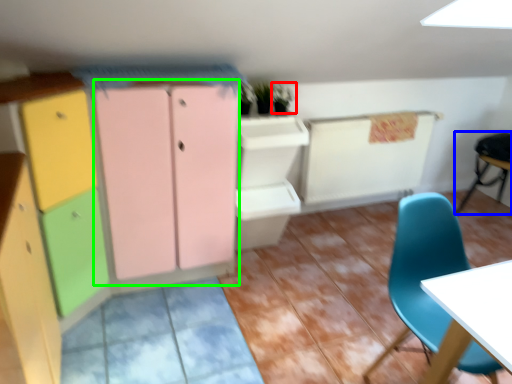
Question: Which is farther away from plant (highlighted by a red box)? chair (highlighted by a blue box) or cabinetry (highlighted by a green box)?

Choices:
 (A) chair
 (B) cabinetry

Answer: (A)